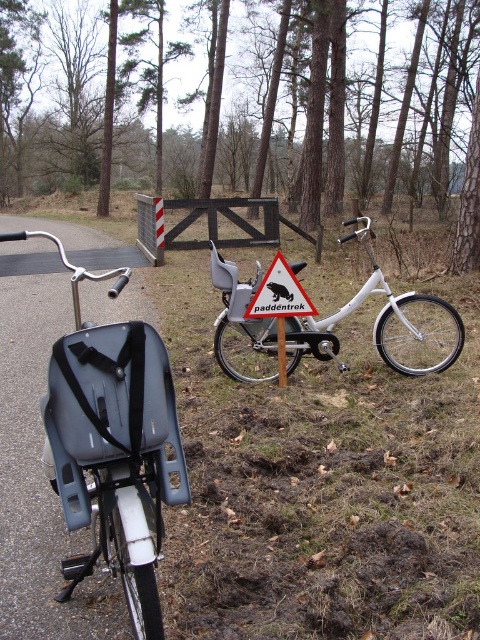
Question: Which of these objects is positioned closest to the metallic triangular sign at center?

Choices:
 (A) white matte bicycle at center
 (B) matte black bicycle seat at center
 (C) brown wood tree at upper center

Answer: (A)

Question: Is matte black bicycle seat at center further to camera compared to metallic triangular sign at center?

Choices:
 (A) no
 (B) yes

Answer: (A)

Question: Does matte black bicycle seat at center appear on the left side of metallic triangular sign at center?

Choices:
 (A) yes
 (B) no

Answer: (A)

Question: Among these points, which one is farthest from the camera?

Choices:
 (A) (75, 396)
 (B) (395, 298)

Answer: (B)

Question: Is matte black bicycle seat at center thinner than white matte bicycle at center?

Choices:
 (A) yes
 (B) no

Answer: (A)

Question: Which of the following is the closest to the observer?

Choices:
 (A) (362, 298)
 (B) (285, 262)

Answer: (B)